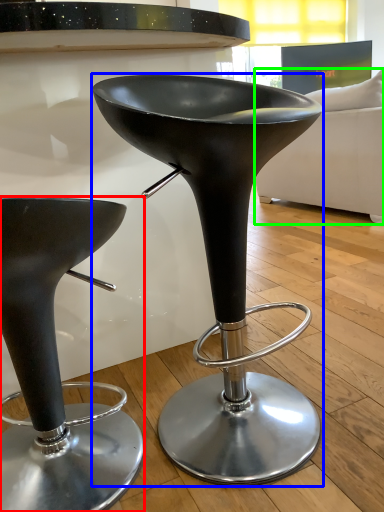
Question: Which object is the farthest from stool (highlighted by a red box)? Choose among these: stool (highlighted by a blue box) or couch (highlighted by a green box).

Choices:
 (A) stool
 (B) couch

Answer: (B)